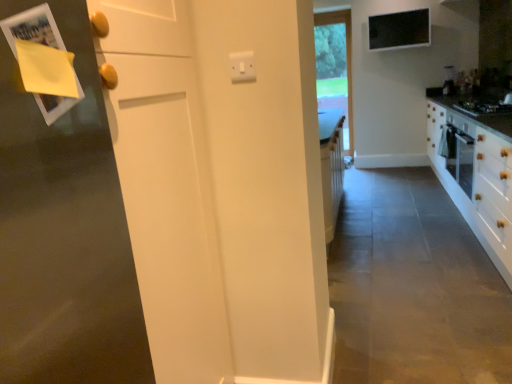
What do you see at coordinates (481, 106) in the screenshot?
I see `black glass gas stove at right` at bounding box center [481, 106].

At what (x,y) coordinates should I click in order to perform the action: click on black glass gas stove at right. Please return your answer as a coordinate pair (x, y). Image resolution: width=512 pixels, height=384 pixels. Looking at the image, I should click on (481, 106).

Where is `clear glass window at center`? This screenshot has width=512, height=384. clear glass window at center is located at coordinates (347, 57).

This screenshot has height=384, width=512. Describe the element at coordinates (347, 57) in the screenshot. I see `clear glass window at center` at that location.

Image resolution: width=512 pixels, height=384 pixels. What are the coordinates of `black glass gas stove at right` in the screenshot? It's located at (481, 106).

Which object is positioned more to the left, black glass gas stove at right or clear glass window at center?

Positioned to the left is clear glass window at center.

Which object is further away from the camera, black glass gas stove at right or clear glass window at center?

clear glass window at center is further from the camera.

Does point (492, 105) lie behind point (346, 54)?

No.

From the image's perspective, is black glass gas stove at right below clear glass window at center?

Correct, black glass gas stove at right appears lower than clear glass window at center in the image.

From a real-world perspective, is black glass gas stove at right physically below clear glass window at center?

Yes, from a real-world perspective, black glass gas stove at right is beneath clear glass window at center.

Is black glass gas stove at right wider or thinner than clear glass window at center?

Clearly, black glass gas stove at right has more width compared to clear glass window at center.

Considering the relative sizes of black glass gas stove at right and clear glass window at center in the image provided, is black glass gas stove at right taller than clear glass window at center?

No, black glass gas stove at right is not taller than clear glass window at center.

From the picture: Considering the sizes of objects black glass gas stove at right and clear glass window at center in the image provided, who is smaller, black glass gas stove at right or clear glass window at center?

With smaller size is black glass gas stove at right.

Does black glass gas stove at right contain clear glass window at center?

Definitely not — clear glass window at center is not inside black glass gas stove at right.

Is black glass gas stove at right next to clear glass window at center and touching it?

No, black glass gas stove at right is not next to clear glass window at center.

Could you tell me if black glass gas stove at right is facing clear glass window at center?

No, black glass gas stove at right is not aimed at clear glass window at center.

How distant is black glass gas stove at right from clear glass window at center?

The distance of black glass gas stove at right from clear glass window at center is 6.54 feet.

I want to click on window above the black glass gas stove at right (from the image's perspective), so click(x=347, y=57).

Can you confirm if clear glass window at center is positioned to the right of black glass gas stove at right?

No, clear glass window at center is not to the right of black glass gas stove at right.

Relative to black glass gas stove at right, is clear glass window at center in front or behind?

Visually, clear glass window at center is located behind black glass gas stove at right.

Considering the points (319, 16) and (480, 103), which point is behind, point (319, 16) or point (480, 103)?

The point (319, 16) is behind.

From the image's perspective, which is below, clear glass window at center or black glass gas stove at right?

black glass gas stove at right is shown below in the image.

From a real-world perspective, is clear glass window at center over black glass gas stove at right?

Yes, from a real-world perspective, clear glass window at center is over black glass gas stove at right

Considering the sizes of clear glass window at center and black glass gas stove at right in the image, is clear glass window at center wider or thinner than black glass gas stove at right?

Considering their sizes, clear glass window at center looks slimmer than black glass gas stove at right.

Is clear glass window at center shorter than black glass gas stove at right?

No, clear glass window at center is not shorter than black glass gas stove at right.

Which of these two, clear glass window at center or black glass gas stove at right, is bigger?

clear glass window at center is bigger.

Consider the image. Is clear glass window at center situated inside black glass gas stove at right or outside?

The correct answer is: outside.

Is clear glass window at center in contact with black glass gas stove at right?

clear glass window at center and black glass gas stove at right are not in contact.

Is clear glass window at center oriented away from black glass gas stove at right?

clear glass window at center is not turned away from black glass gas stove at right.

How different are the orientations of clear glass window at center and black glass gas stove at right in degrees?

They differ by 90.9 degrees in their facing directions.

The image size is (512, 384). Find the location of `window that appears above the black glass gas stove at right (from the image's perspective)`. window that appears above the black glass gas stove at right (from the image's perspective) is located at coordinates (347, 57).

This screenshot has height=384, width=512. I want to click on gas stove to the right of clear glass window at center, so click(481, 106).

Where is `window above the black glass gas stove at right (from a real-world perspective)`? The width and height of the screenshot is (512, 384). window above the black glass gas stove at right (from a real-world perspective) is located at coordinates (347, 57).